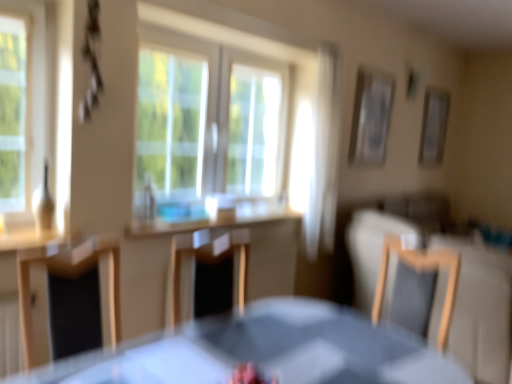
Question: Should I look upward or downward to see light brown wooden chair at right, acting as the second chair starting from the left?

Choices:
 (A) down
 (B) up

Answer: (A)

Question: Is light brown wooden chair at right, the 1th chair in the right-to-left sequence, aimed at white sheer curtain at upper center?

Choices:
 (A) yes
 (B) no

Answer: (B)

Question: Is light brown wooden chair at right, the 1th chair in the right-to-left sequence, facing away from white sheer curtain at upper center?

Choices:
 (A) no
 (B) yes

Answer: (A)

Question: Can you confirm if light brown wooden chair at right, the 1th chair in the right-to-left sequence, is thinner than white sheer curtain at upper center?

Choices:
 (A) yes
 (B) no

Answer: (B)

Question: Does light brown wooden chair at right, the 1th chair in the right-to-left sequence, have a lesser height compared to white sheer curtain at upper center?

Choices:
 (A) yes
 (B) no

Answer: (A)

Question: From a real-world perspective, is light brown wooden chair at right, the 1th chair in the right-to-left sequence, located beneath white sheer curtain at upper center?

Choices:
 (A) yes
 (B) no

Answer: (A)

Question: Does light brown wooden chair at right, acting as the second chair starting from the left, have a greater width compared to white sheer curtain at upper center?

Choices:
 (A) yes
 (B) no

Answer: (A)

Question: Is white sheer curtain at upper center further to camera compared to light brown wooden chair at right, the 1th chair in the right-to-left sequence?

Choices:
 (A) no
 (B) yes

Answer: (B)

Question: Is white sheer curtain at upper center shorter than light brown wooden chair at right, the 1th chair in the right-to-left sequence?

Choices:
 (A) no
 (B) yes

Answer: (A)

Question: Is white sheer curtain at upper center wider than light brown wooden chair at right, the 1th chair in the right-to-left sequence?

Choices:
 (A) no
 (B) yes

Answer: (A)

Question: Can you confirm if white sheer curtain at upper center is bigger than light brown wooden chair at right, the 1th chair in the right-to-left sequence?

Choices:
 (A) no
 (B) yes

Answer: (B)

Question: Considering the relative positions of white sheer curtain at upper center and light brown wooden chair at right, acting as the second chair starting from the left, in the image provided, is white sheer curtain at upper center to the right of light brown wooden chair at right, acting as the second chair starting from the left, from the viewer's perspective?

Choices:
 (A) no
 (B) yes

Answer: (A)

Question: From a real-world perspective, is white sheer curtain at upper center over light brown wooden chair at right, the 1th chair in the right-to-left sequence?

Choices:
 (A) no
 (B) yes

Answer: (B)

Question: Does wooden chair at center, the 2th chair in the right-to-left sequence, have a greater width compared to light brown wooden chair at right, the 1th chair in the right-to-left sequence?

Choices:
 (A) no
 (B) yes

Answer: (B)